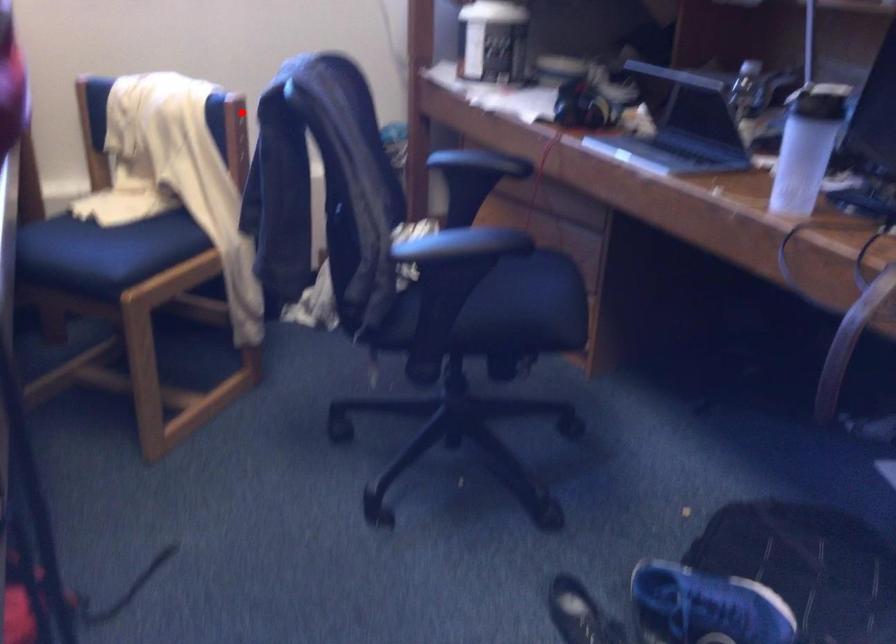
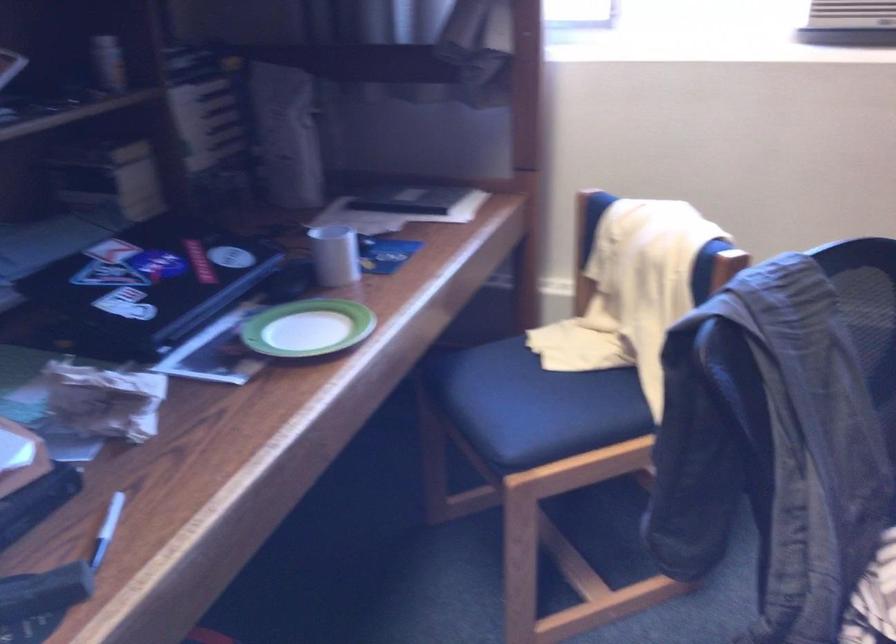
Question: I am providing you with two images of the same scene from different viewpoints. In image1, a red point is highlighted. Considering the same 3D point in image2, which of the following is correct?

Choices:
 (A) It is closer
 (B) It is farther

Answer: (A)